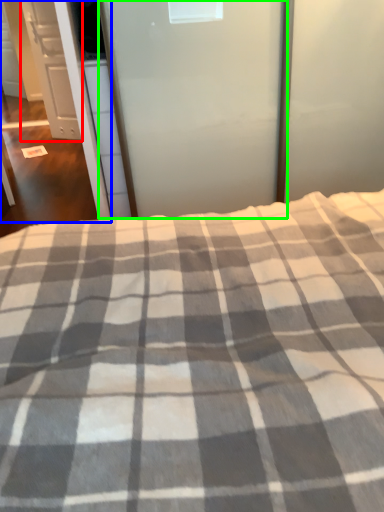
Question: Which is nearer to the cabinetry (highlighted by a red box)? screen door (highlighted by a blue box) or screen door (highlighted by a green box).

Choices:
 (A) screen door
 (B) screen door

Answer: (A)